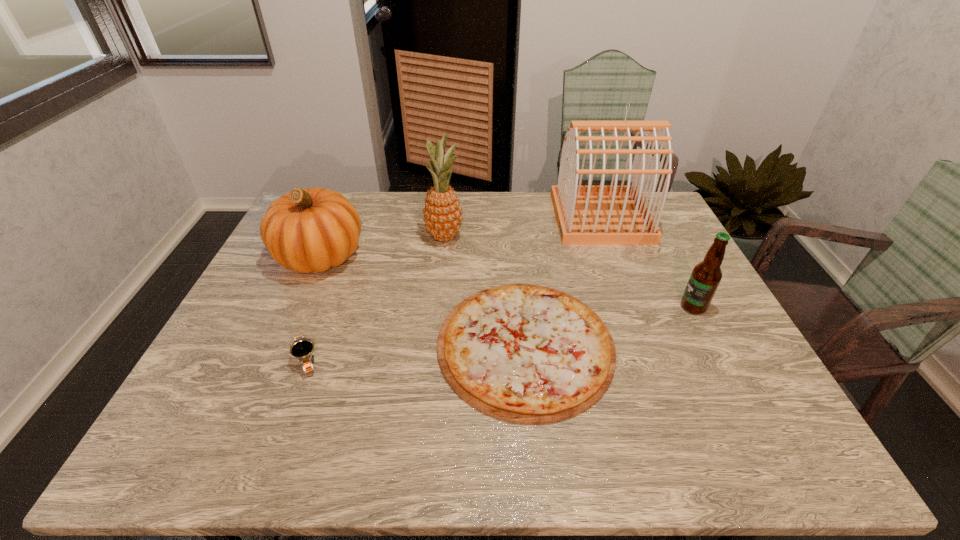
Identify the location of free space located 0.130m on the back of the pumpkin. (341, 208).

What are the coordinates of `vacant space located on the label of the beer bottle` in the screenshot? It's located at (639, 307).

This screenshot has width=960, height=540. What are the coordinates of `vacant position located on the label of the beer bottle` in the screenshot? It's located at (651, 307).

You are a GUI agent. You are given a task and a screenshot of the screen. Output one action in this format:
    pyautogui.click(x=<x>, y=<y>)
    Task: Click on the vacant space situated 0.170m on the label of the beer bottle
    
    Given the screenshot: What is the action you would take?
    pyautogui.click(x=617, y=307)

Find the location of `vacant space located 0.240m on the back of the second shortest object`. vacant space located 0.240m on the back of the second shortest object is located at coordinates (337, 278).

The image size is (960, 540). Find the location of `free region located on the left of the shortest object`. free region located on the left of the shortest object is located at coordinates (405, 345).

Locate an element on the screen. The image size is (960, 540). birdcage that is at the far edge is located at coordinates (586, 215).

Image resolution: width=960 pixels, height=540 pixels. Find the location of `pineapple that is at the far edge`. pineapple that is at the far edge is located at coordinates (442, 214).

At what (x,y) coordinates should I click in order to perform the action: click on pumpkin at the far edge. Please return your answer as a coordinate pair (x, y). Image resolution: width=960 pixels, height=540 pixels. Looking at the image, I should click on [x=306, y=230].

At what (x,y) coordinates should I click in order to perform the action: click on object positioned at the near edge. Please return your answer as a coordinate pair (x, y). The image size is (960, 540). Looking at the image, I should click on (523, 353).